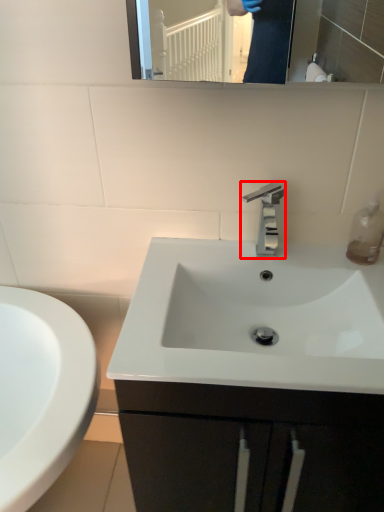
Question: From the image, what is the correct spatial relationship of tap (annotated by the red box) in relation to soap dispenser?

Choices:
 (A) left
 (B) right

Answer: (A)